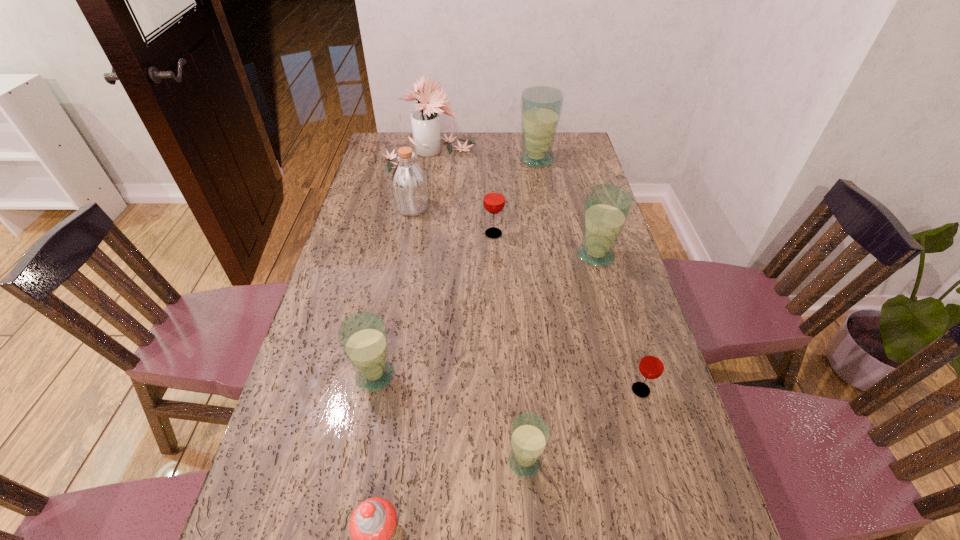
Choose which blue glass is the fourth nearest neighbor to the nearest object. Please provide its 2D coordinates. Your answer should be formatted as a tuple, i.e. [(x, y)], where the tuple contains the x and y coordinates of a point satisfying the conditions above.

[(541, 106)]

Where is `blue glass object that ranks as the fourth closest to the fourth farthest object`? This screenshot has height=540, width=960. blue glass object that ranks as the fourth closest to the fourth farthest object is located at coordinates (529, 434).

The width and height of the screenshot is (960, 540). Identify the location of free space in the image that satisfies the following two spatial constraints: 1. on the front side of the farthest blue glass; 2. on the right side of the white bouquet. (427, 160).

Identify the location of free location that satisfies the following two spatial constraints: 1. on the back side of the second blue glass from left to right; 2. on the left side of the nearer red glass. The height and width of the screenshot is (540, 960). pyautogui.click(x=520, y=390).